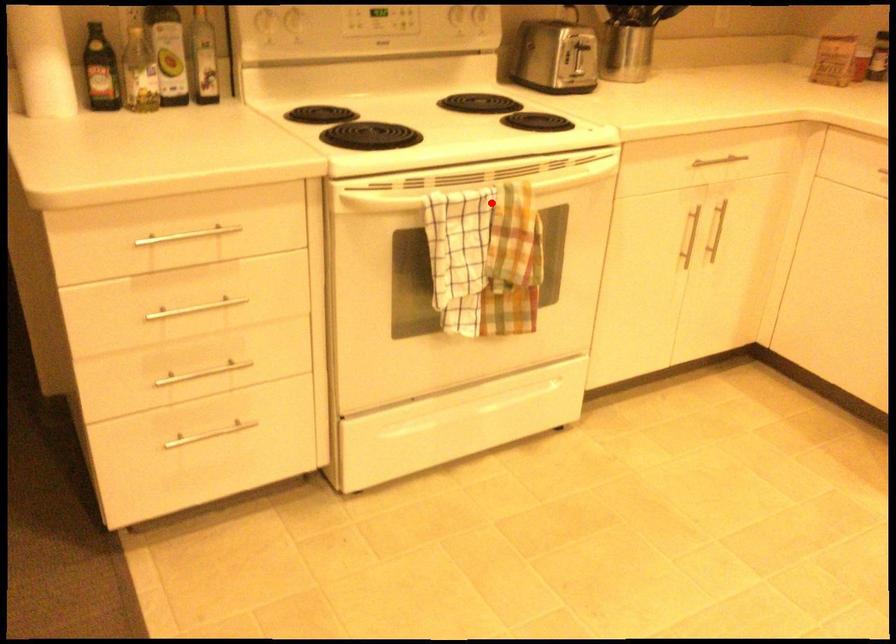
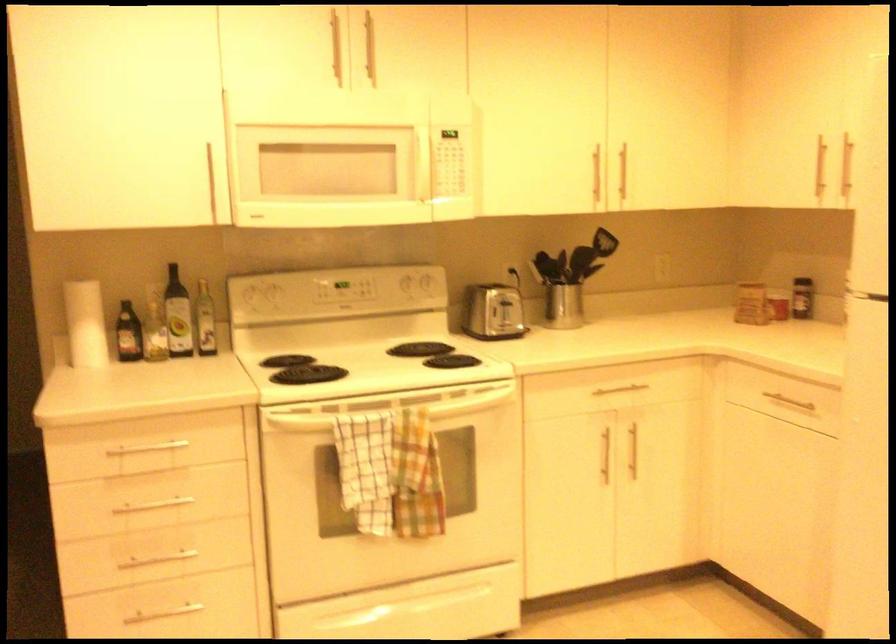
Question: I am providing you with two images of the same scene from different viewpoints. A red point is shown in image1. For the corresponding object point in image2, is it positioned nearer or farther from the camera?

Choices:
 (A) Nearer
 (B) Farther

Answer: (B)